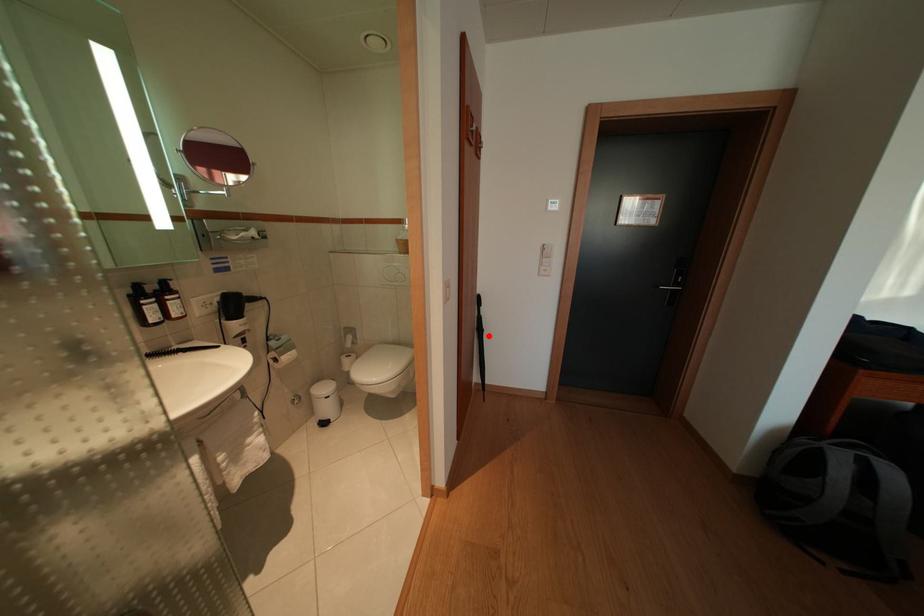
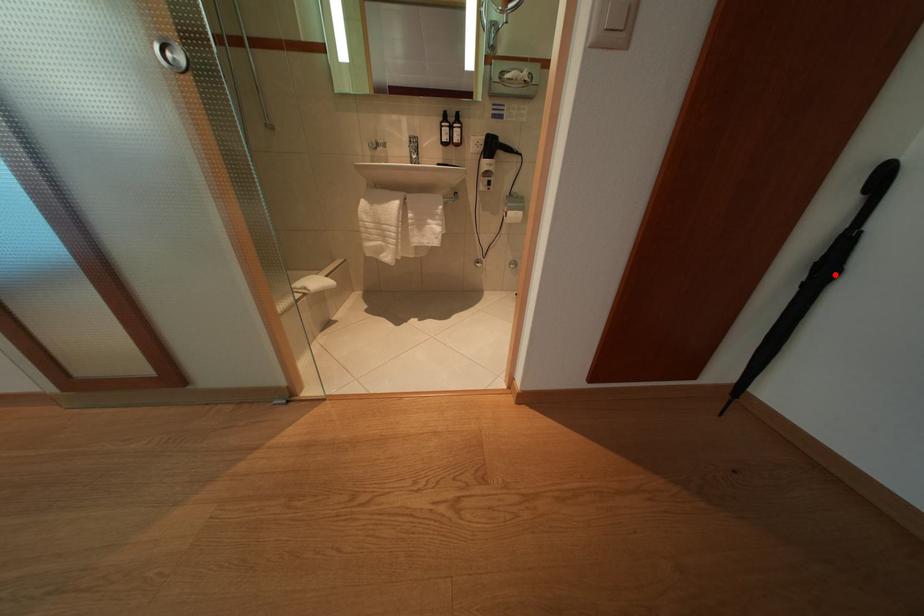
I am providing you with two images of the same scene from different viewpoints. A red point is marked on the first image and another point is marked on the second image. Does the point marked in image1 correspond to the same location as the one in image2?

Yes